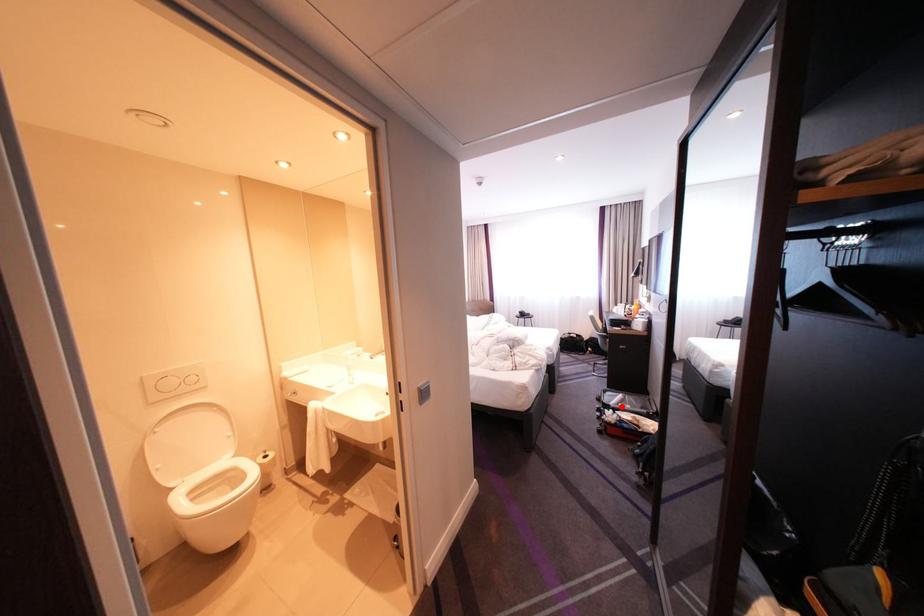
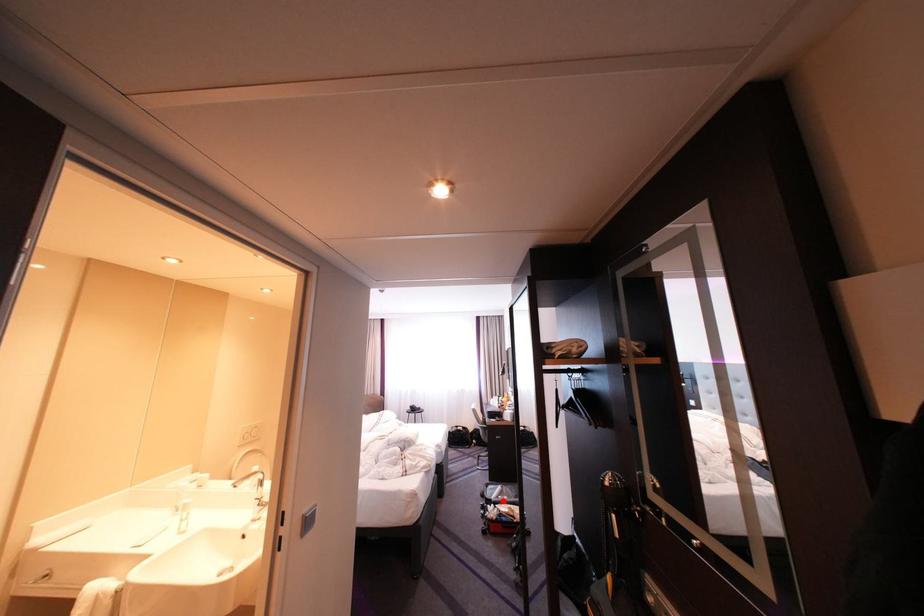
I am providing you with two images of the same scene from different viewpoints. A red point is marked on the first image and another point is marked on the second image. Is the marked point in image1 the same physical position as the marked point in image2?

Yes